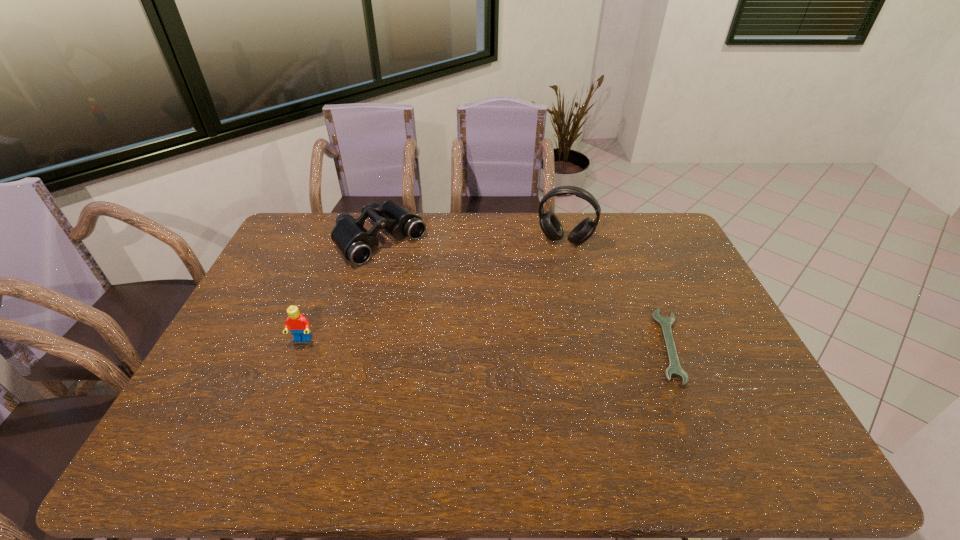
The height and width of the screenshot is (540, 960). In order to click on free spot on the desktop that is between the Lego and the wrench and is positioned on the front-facing side of the binoculars in this screenshot , I will do `click(497, 343)`.

Where is `free space on the desktop that is between the Lego and the rightmost object and is positioned on the earcups of the second object from right to left`? The height and width of the screenshot is (540, 960). free space on the desktop that is between the Lego and the rightmost object and is positioned on the earcups of the second object from right to left is located at coordinates (533, 344).